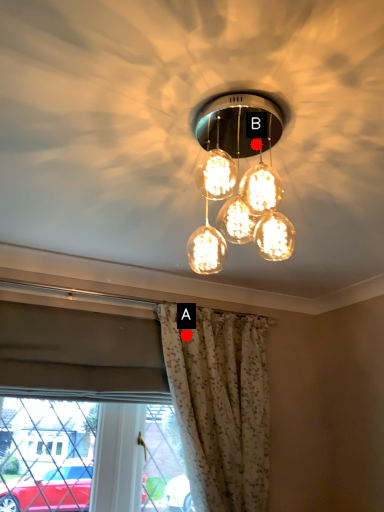
Question: Two points are circled on the image, labeled by A and B beside each circle. Which point appears closest to the camera in this image?

Choices:
 (A) A is closer
 (B) B is closer

Answer: (A)